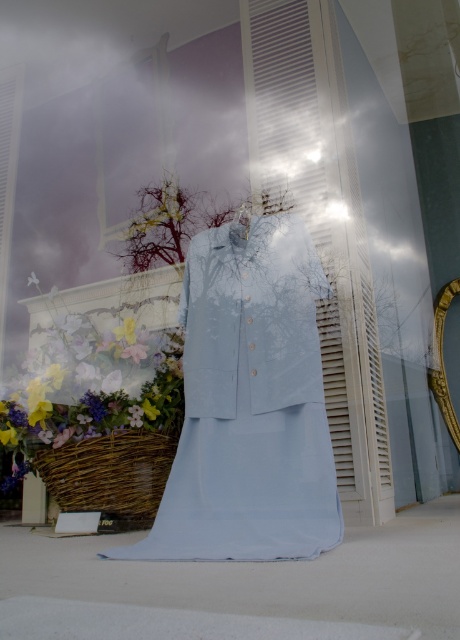
You are a window cleaner standing 1.5 meters away from the gold metallic mirror at right. You want to clean the light blue fabric dress at center. Can you reach it without moving your position?

The distance between the light blue fabric dress at center and the gold metallic mirror at right is 2.28 meters. Since you are 1.5 meters away from the mirror, the dress is 2.28 meters away from the mirror, so you are 1.5 meters away from the mirror and the dress is 2.28 meters away from the mirror. Therefore, the total distance between you and the dress is 1.5 meters plus 2.28 meters, totaling 3.78 meters. Unless you have an extendable tool, you cannot reach the light blue fabric dress at center from your